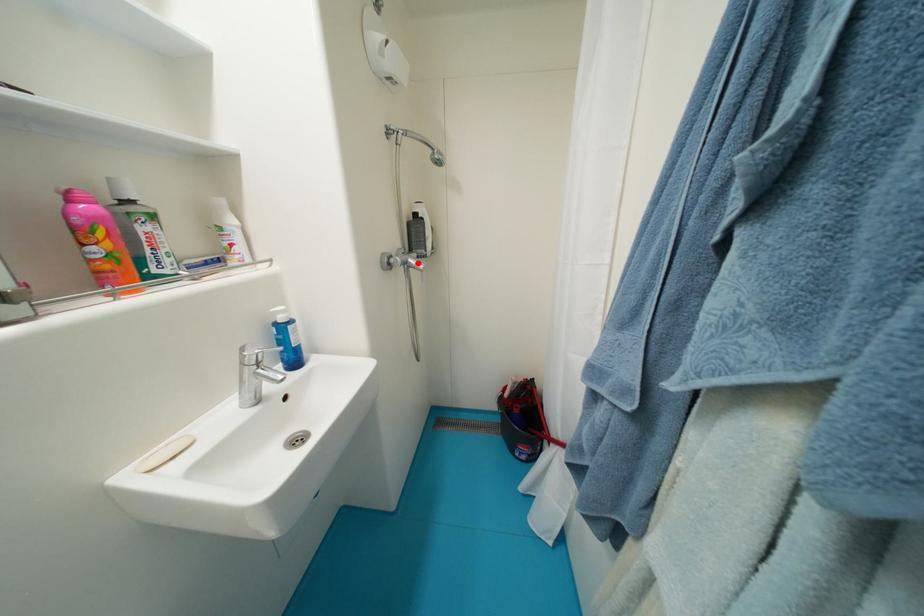
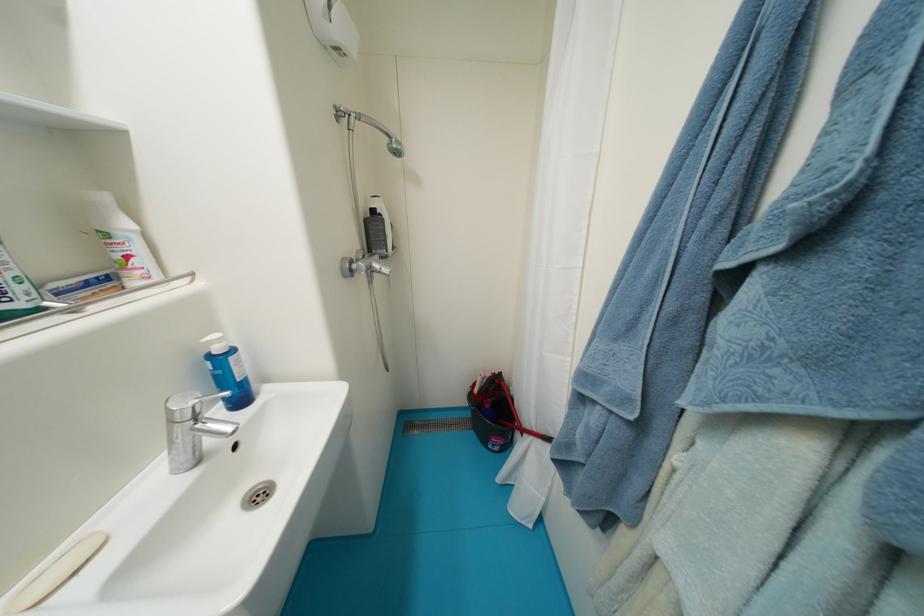
The point at the highlighted location is marked in the first image. Where is the corresponding point in the second image?

(383, 267)